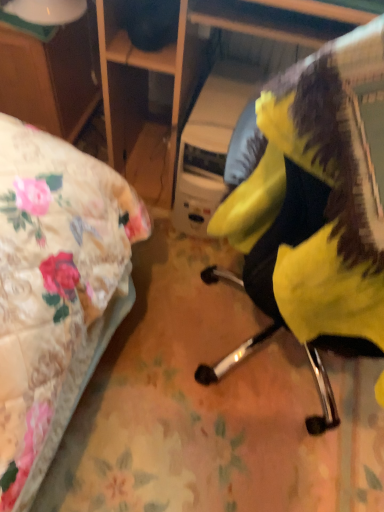
Question: From the image's perspective, is yellow fabric chair at center located beneath wooden desk at left?

Choices:
 (A) no
 (B) yes

Answer: (B)

Question: Can you confirm if yellow fabric chair at center is taller than wooden desk at left?

Choices:
 (A) yes
 (B) no

Answer: (A)

Question: Is yellow fabric chair at center completely or partially outside of wooden desk at left?

Choices:
 (A) yes
 (B) no

Answer: (A)

Question: Is yellow fabric chair at center positioned before wooden desk at left?

Choices:
 (A) yes
 (B) no

Answer: (A)

Question: Is yellow fabric chair at center smaller than wooden desk at left?

Choices:
 (A) no
 (B) yes

Answer: (B)

Question: Considering the relative positions of yellow fabric chair at center and wooden desk at left in the image provided, is yellow fabric chair at center to the right of wooden desk at left from the viewer's perspective?

Choices:
 (A) yes
 (B) no

Answer: (A)

Question: From a real-world perspective, is wooden desk at left beneath yellow fabric chair at center?

Choices:
 (A) no
 (B) yes

Answer: (B)

Question: Can you confirm if wooden desk at left is positioned to the right of yellow fabric chair at center?

Choices:
 (A) yes
 (B) no

Answer: (B)

Question: From a real-world perspective, is wooden desk at left positioned over yellow fabric chair at center based on gravity?

Choices:
 (A) no
 (B) yes

Answer: (A)

Question: Is wooden desk at left located outside yellow fabric chair at center?

Choices:
 (A) no
 (B) yes

Answer: (B)

Question: Considering the relative sizes of wooden desk at left and yellow fabric chair at center in the image provided, is wooden desk at left taller than yellow fabric chair at center?

Choices:
 (A) yes
 (B) no

Answer: (B)

Question: Can you see wooden desk at left touching yellow fabric chair at center?

Choices:
 (A) no
 (B) yes

Answer: (A)

Question: From a real-world perspective, is yellow fabric chair at center positioned above or below wooden desk at left?

Choices:
 (A) below
 (B) above

Answer: (B)